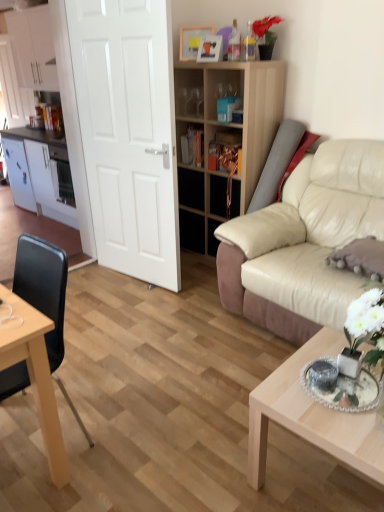
Question: From a real-world perspective, is white matte door at center positioned over wooden shelf at center based on gravity?

Choices:
 (A) no
 (B) yes

Answer: (B)

Question: Is the depth of white matte door at center greater than that of wooden shelf at center?

Choices:
 (A) no
 (B) yes

Answer: (A)

Question: Does white matte door at center have a lesser height compared to wooden shelf at center?

Choices:
 (A) yes
 (B) no

Answer: (B)

Question: Is white matte door at center oriented away from wooden shelf at center?

Choices:
 (A) no
 (B) yes

Answer: (B)

Question: Can you confirm if white matte door at center is smaller than wooden shelf at center?

Choices:
 (A) no
 (B) yes

Answer: (B)

Question: Is white glossy cabinet at left, which appears as the 2th cabinetry when viewed from the top, wider or thinner than light wood/texture coffee table at lower right?

Choices:
 (A) thin
 (B) wide

Answer: (A)

Question: In terms of height, does white glossy cabinet at left, which appears as the 2th cabinetry when viewed from the top, look taller or shorter compared to light wood/texture coffee table at lower right?

Choices:
 (A) short
 (B) tall

Answer: (B)

Question: Do you think white glossy cabinet at left, which appears as the 2th cabinetry when viewed from the top, is within light wood/texture coffee table at lower right, or outside of it?

Choices:
 (A) outside
 (B) inside

Answer: (A)

Question: Looking at the image, does white glossy cabinet at left, which appears as the 2th cabinetry when viewed from the top, seem bigger or smaller compared to light wood/texture coffee table at lower right?

Choices:
 (A) small
 (B) big

Answer: (A)

Question: Is gray suede pillow at right taller or shorter than matte white cabinet at left?

Choices:
 (A) tall
 (B) short

Answer: (B)

Question: From the image's perspective, is gray suede pillow at right positioned above or below matte white cabinet at left?

Choices:
 (A) below
 (B) above

Answer: (A)

Question: Is point (357, 239) positioned closer to the camera than point (54, 87)?

Choices:
 (A) farther
 (B) closer

Answer: (B)

Question: Do you think gray suede pillow at right is within matte white cabinet at left, or outside of it?

Choices:
 (A) inside
 (B) outside

Answer: (B)

Question: Looking at their shapes, would you say white glossy cabinet at upper left, the 1th cabinetry viewed from the top, is wider or thinner than white glossy cabinet at left, which is the 2th cabinetry from bottom to top?

Choices:
 (A) thin
 (B) wide

Answer: (B)

Question: From a real-world perspective, is white glossy cabinet at upper left, the third cabinetry in the bottom-to-top sequence, positioned above or below white glossy cabinet at left, which appears as the 2th cabinetry when viewed from the top?

Choices:
 (A) above
 (B) below

Answer: (A)